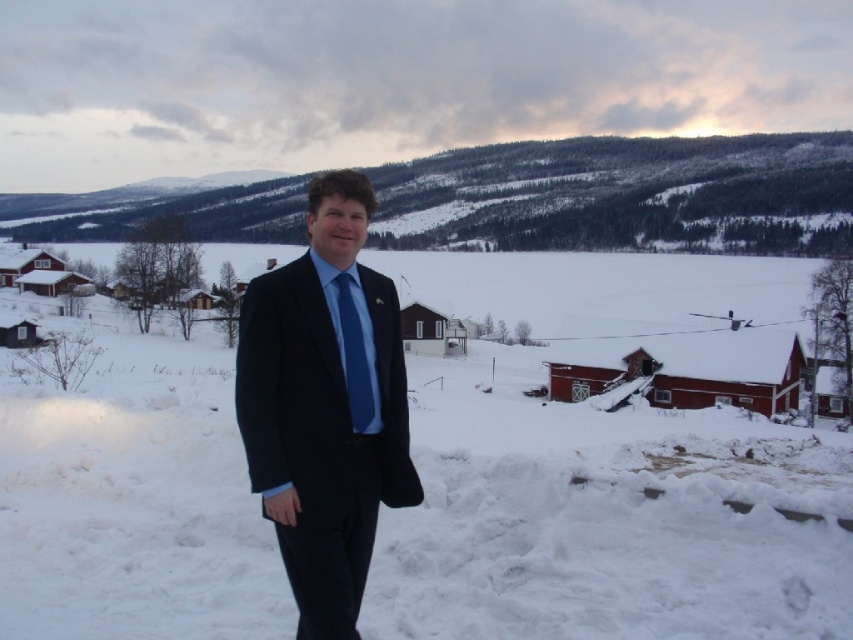
You are a photographer standing at the camera position. You want to take a closeup shot of the matte black suit at center. The camera has a minimum focusing distance of 2 meters. Can you take the photo without moving closer?

The matte black suit at center is 3.84 meters away from the camera. Since the minimum focusing distance is 2 meters, the camera can focus on the matte black suit at center from this distance, so yes, you can take the closeup shot without moving closer.

You are a photographer trying to capture a photo of the white fluffy snow at center and the blue silk tie at center. The camera you are using has a maximum focus range of 80 feet. Can you focus on both objects simultaneously?

The distance between the white fluffy snow at center and the blue silk tie at center is 83.52 feet. Since the camera can only focus up to 80 feet, it cannot capture both objects in focus at the same time.

You are a photographer trying to capture a clear shot of the matte black suit at center without the white fluffy snow at center blocking it. Is this possible given their positions?

The matte black suit at center is behind the white fluffy snow at center, so it would be blocked by the snow and not visible in the shot.